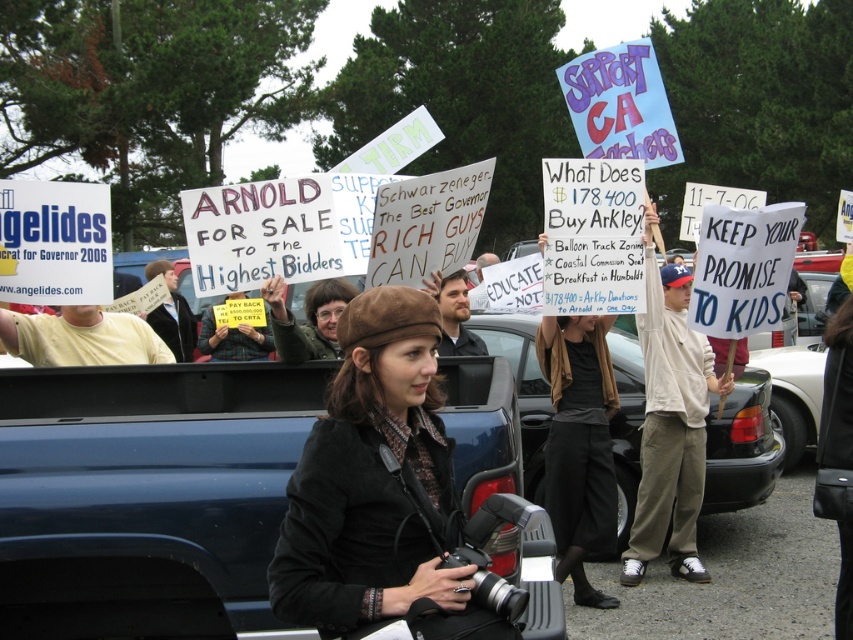
You are a photographer at the protest scene. You want to place your camera exactly at the center of the image. The brown suede beret at center is currently at a specific coordinate. Is the beret positioned to the left or right of the image center?

The brown suede beret at center is located at point 0.762 on the x axis, which is to the right of the image center since the center would be at 0.5. Therefore, the beret is positioned to the right of the image center.

You are a photographer trying to capture the protest scene. You notice the brown suede beret at center. Where exactly is it positioned in the image?

The brown suede beret at center is located at point 0.762 along the horizontal axis and 0.444 along the vertical axis.